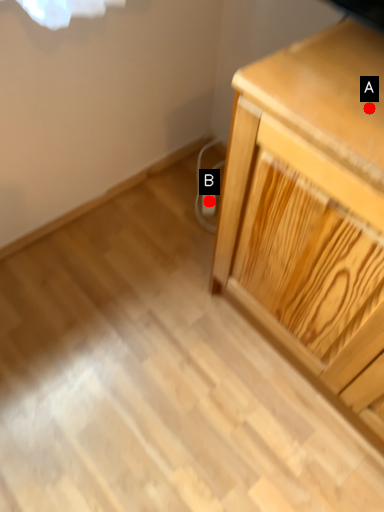
Question: Two points are circled on the image, labeled by A and B beside each circle. Which point is closer to the camera taking this photo?

Choices:
 (A) A is closer
 (B) B is closer

Answer: (A)